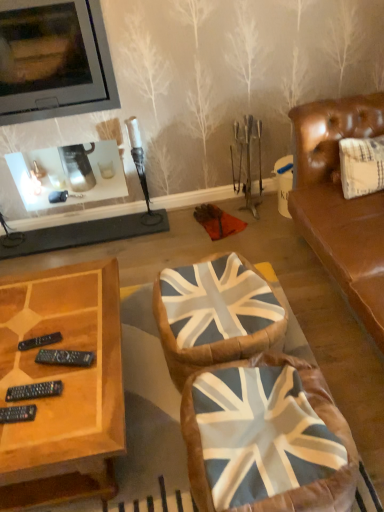
Question: Is matte black television at upper left oriented away from union jack fabric swivel chair at center, which appears as the 2th swivel chair when viewed from the back?

Choices:
 (A) no
 (B) yes

Answer: (A)

Question: Is matte black television at upper left closer to the viewer compared to union jack fabric swivel chair at center, which appears as the 2th swivel chair when viewed from the back?

Choices:
 (A) yes
 (B) no

Answer: (B)

Question: From the image's perspective, is matte black television at upper left on top of union jack fabric swivel chair at center, the 1th swivel chair positioned from the front?

Choices:
 (A) yes
 (B) no

Answer: (A)

Question: Is matte black television at upper left oriented towards union jack fabric swivel chair at center, which appears as the 2th swivel chair when viewed from the back?

Choices:
 (A) no
 (B) yes

Answer: (B)

Question: Does matte black television at upper left have a smaller size compared to union jack fabric swivel chair at center, the 1th swivel chair positioned from the front?

Choices:
 (A) yes
 (B) no

Answer: (B)

Question: Does point (102, 101) appear closer or farther from the camera than point (228, 412)?

Choices:
 (A) closer
 (B) farther

Answer: (B)

Question: Based on their sizes in the image, would you say matte black television at upper left is bigger or smaller than union jack fabric swivel chair at center, which appears as the 2th swivel chair when viewed from the back?

Choices:
 (A) small
 (B) big

Answer: (B)

Question: From a real-world perspective, is matte black television at upper left positioned above or below union jack fabric swivel chair at center, which appears as the 2th swivel chair when viewed from the back?

Choices:
 (A) above
 (B) below

Answer: (A)

Question: Considering their positions, is matte black television at upper left located in front of or behind union jack fabric swivel chair at center, which appears as the 2th swivel chair when viewed from the back?

Choices:
 (A) behind
 (B) front

Answer: (A)

Question: Looking at the image, does union jack fabric swivel chair at center, which appears as the 2th swivel chair when viewed from the back, seem bigger or smaller compared to union jack fabric swivel chair at center, the second swivel chair when ordered from front to back?

Choices:
 (A) small
 (B) big

Answer: (B)

Question: Is union jack fabric swivel chair at center, the 1th swivel chair positioned from the front, inside or outside of union jack fabric swivel chair at center, the second swivel chair when ordered from front to back?

Choices:
 (A) inside
 (B) outside

Answer: (B)

Question: In the image, is union jack fabric swivel chair at center, the 1th swivel chair positioned from the front, positioned in front of or behind union jack fabric swivel chair at center, the 1th swivel chair when ordered from back to front?

Choices:
 (A) behind
 (B) front

Answer: (B)

Question: From the image's perspective, relative to union jack fabric swivel chair at center, the second swivel chair when ordered from front to back, is union jack fabric swivel chair at center, the 1th swivel chair positioned from the front, above or below?

Choices:
 (A) below
 (B) above

Answer: (A)

Question: Looking at the image, does union jack fabric swivel chair at center, the second swivel chair when ordered from front to back, seem bigger or smaller compared to union jack fabric swivel chair at center, which appears as the 2th swivel chair when viewed from the back?

Choices:
 (A) small
 (B) big

Answer: (A)

Question: Would you say union jack fabric swivel chair at center, the second swivel chair when ordered from front to back, is to the left or to the right of union jack fabric swivel chair at center, the 1th swivel chair positioned from the front, in the picture?

Choices:
 (A) left
 (B) right

Answer: (A)